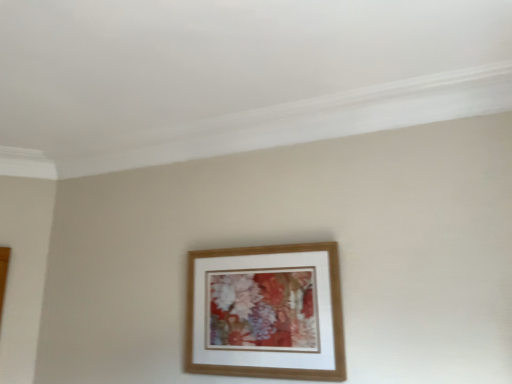
Identify the location of wooden picture frame at center. The width and height of the screenshot is (512, 384). (266, 312).

What is the approximate width of wooden picture frame at center?

2.48 inches.

This screenshot has width=512, height=384. Describe the element at coordinates (266, 312) in the screenshot. I see `wooden picture frame at center` at that location.

The height and width of the screenshot is (384, 512). I want to click on wooden picture frame at center, so click(x=266, y=312).